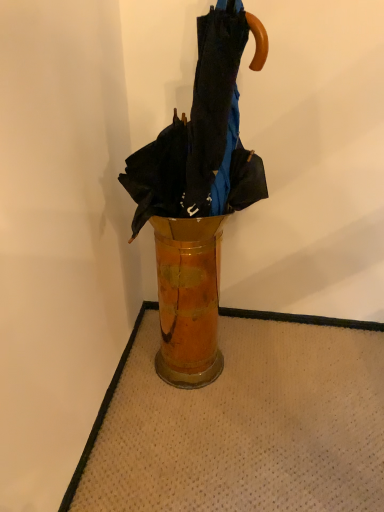
Question: Are wooden vase at center and shiny metallic umbrella at center far apart?

Choices:
 (A) no
 (B) yes

Answer: (A)

Question: Considering the relative sizes of wooden vase at center and shiny metallic umbrella at center in the image provided, is wooden vase at center wider than shiny metallic umbrella at center?

Choices:
 (A) no
 (B) yes

Answer: (A)

Question: Would you say wooden vase at center contains shiny metallic umbrella at center?

Choices:
 (A) yes
 (B) no

Answer: (B)

Question: Is wooden vase at center next to shiny metallic umbrella at center and touching it?

Choices:
 (A) yes
 (B) no

Answer: (B)

Question: Does wooden vase at center appear on the left side of shiny metallic umbrella at center?

Choices:
 (A) yes
 (B) no

Answer: (A)

Question: Is wooden vase at center located outside shiny metallic umbrella at center?

Choices:
 (A) yes
 (B) no

Answer: (A)

Question: Is shiny metallic umbrella at center in contact with wooden vase at center?

Choices:
 (A) no
 (B) yes

Answer: (A)

Question: From the image's perspective, is shiny metallic umbrella at center located above wooden vase at center?

Choices:
 (A) yes
 (B) no

Answer: (A)

Question: Considering the relative sizes of shiny metallic umbrella at center and wooden vase at center in the image provided, is shiny metallic umbrella at center taller than wooden vase at center?

Choices:
 (A) yes
 (B) no

Answer: (A)

Question: Considering the relative sizes of shiny metallic umbrella at center and wooden vase at center in the image provided, is shiny metallic umbrella at center wider than wooden vase at center?

Choices:
 (A) no
 (B) yes

Answer: (B)

Question: Does shiny metallic umbrella at center appear on the left side of wooden vase at center?

Choices:
 (A) no
 (B) yes

Answer: (A)

Question: Is shiny metallic umbrella at center positioned behind wooden vase at center?

Choices:
 (A) no
 (B) yes

Answer: (A)

Question: Is shiny metallic umbrella at center spatially inside wooden vase at center, or outside of it?

Choices:
 (A) inside
 (B) outside

Answer: (B)